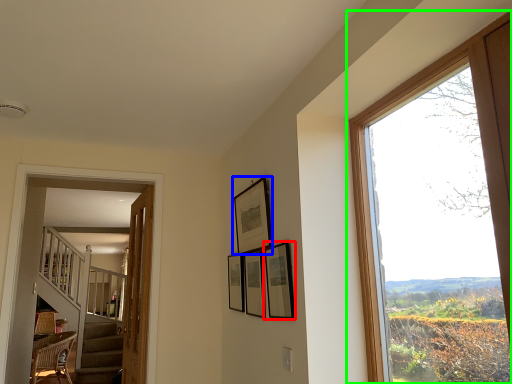
Question: Considering the real-world distances, which object is farthest from picture frame (highlighted by a red box)? picture frame (highlighted by a blue box) or window (highlighted by a green box)?

Choices:
 (A) picture frame
 (B) window

Answer: (B)